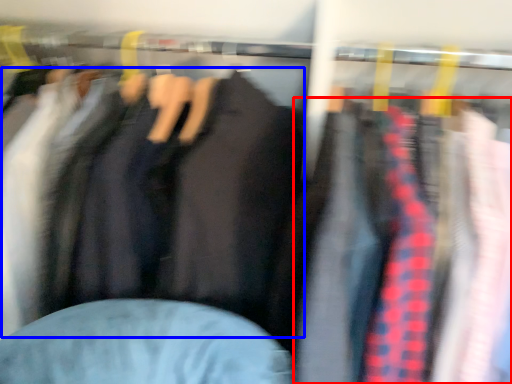
Question: Which object is closer to the camera taking this photo, clothing (highlighted by a red box) or jacket (highlighted by a blue box)?

Choices:
 (A) clothing
 (B) jacket

Answer: (A)